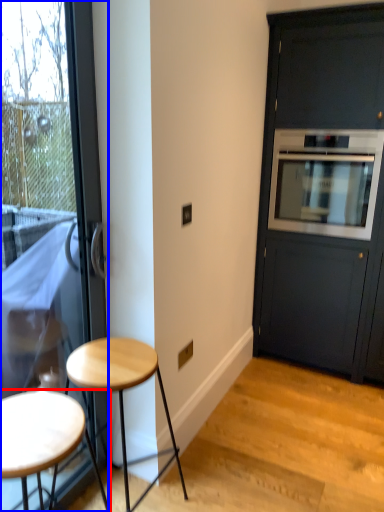
Question: Which object appears farthest to the camera in this image, stool (highlighted by a red box) or door (highlighted by a blue box)?

Choices:
 (A) stool
 (B) door

Answer: (B)